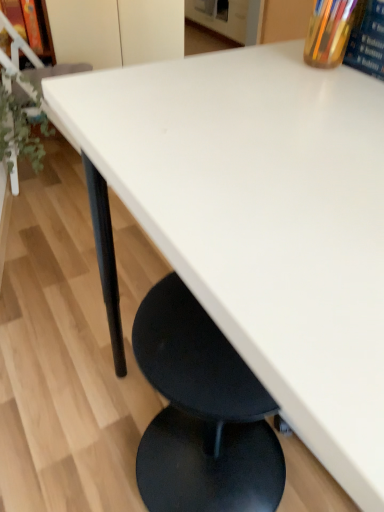
Question: Is green leafy plant at left spatially inside hardcover book at upper right, or outside of it?

Choices:
 (A) inside
 (B) outside

Answer: (B)

Question: Relative to hardcover book at upper right, is green leafy plant at left in front or behind?

Choices:
 (A) front
 (B) behind

Answer: (B)

Question: Which object is positioned closest to the matte wood shelf at upper left?

Choices:
 (A) green leafy plant at left
 (B) translucent glass pen holder at upper right
 (C) hardcover book at upper right

Answer: (A)

Question: Considering the real-world distances, which object is closest to the hardcover book at upper right?

Choices:
 (A) translucent glass pen holder at upper right
 (B) matte wood shelf at upper left
 (C) green leafy plant at left

Answer: (A)